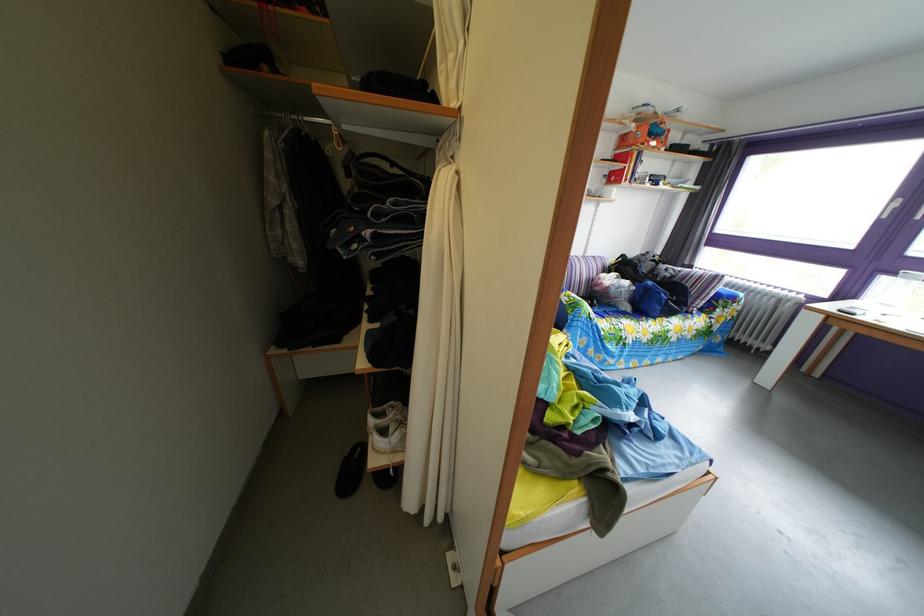
The location [387,427] corresponds to which object?

It refers to a white sneaker.